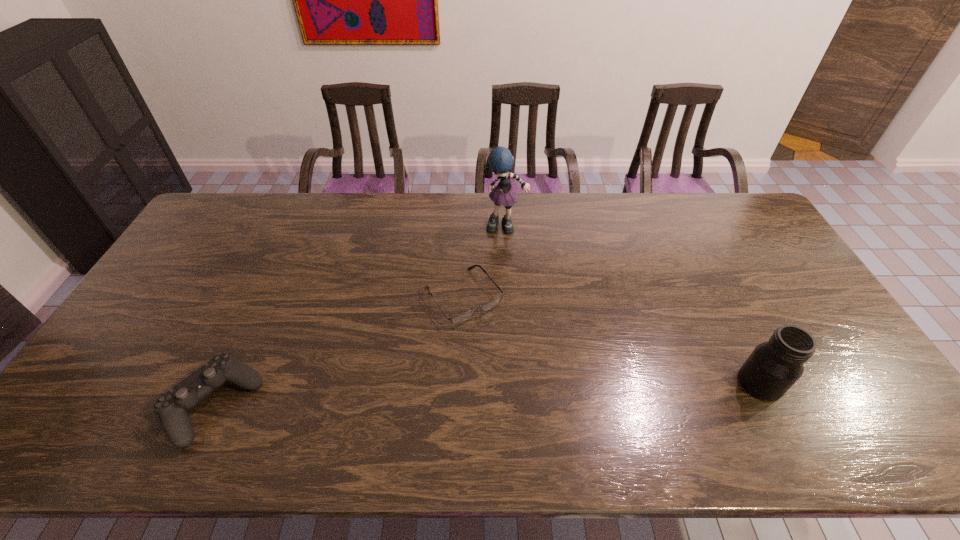
Identify the location of free space at the near edge. (276, 379).

In the image, there is a desktop. Where is `free space at the far left corner`? This screenshot has width=960, height=540. free space at the far left corner is located at coordinates (212, 205).

In the image, there is a desktop. What are the coordinates of `vacant space at the near left corner` in the screenshot? It's located at (87, 409).

Where is `vacant space that's between the third nearest object and the rag doll`? vacant space that's between the third nearest object and the rag doll is located at coordinates (485, 262).

Locate an element on the screen. Image resolution: width=960 pixels, height=540 pixels. free space between the shortest object and the control is located at coordinates (339, 350).

This screenshot has width=960, height=540. I want to click on vacant space that is in between the shortest object and the rightmost object, so click(612, 340).

Identify the location of empty space that is in between the spectacles and the rightmost object. (612, 340).

This screenshot has height=540, width=960. Find the location of `unoccupied position between the second tallest object and the leftmost object`. unoccupied position between the second tallest object and the leftmost object is located at coordinates (487, 394).

Find the location of a particular element. This screenshot has width=960, height=540. free space that is in between the control and the rag doll is located at coordinates (359, 316).

Locate an element on the screen. This screenshot has height=540, width=960. vacant area that lies between the control and the rightmost object is located at coordinates (487, 394).